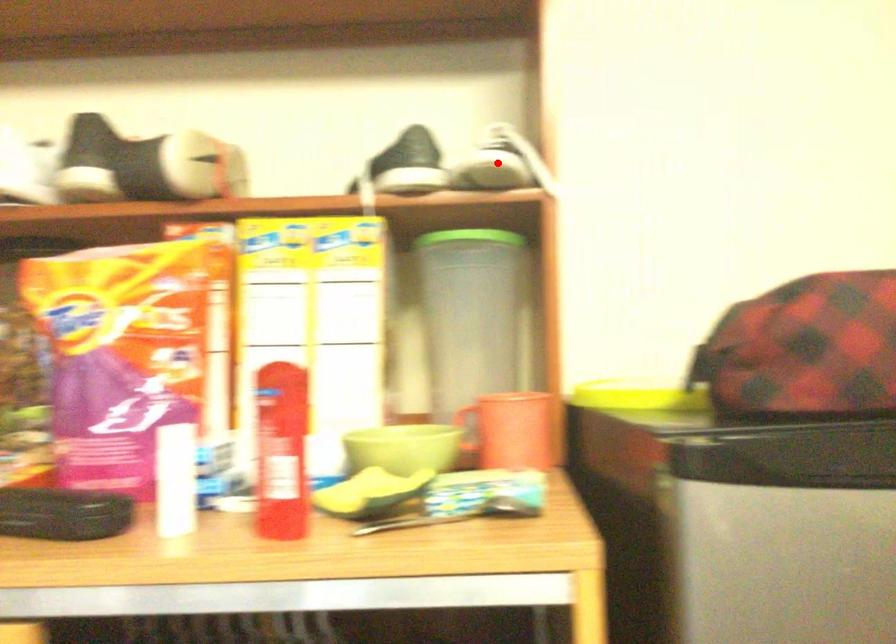
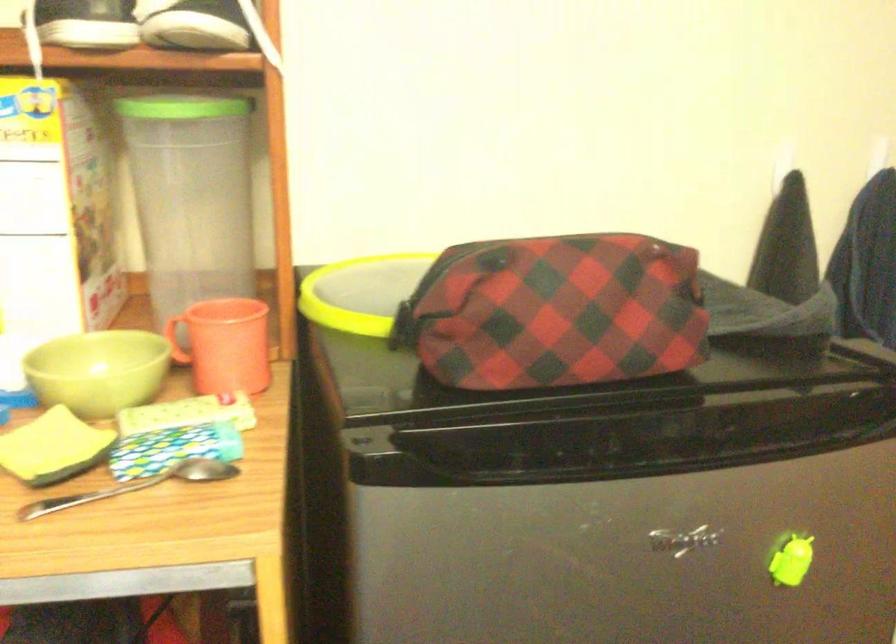
Find the pixel in the second image that matches the highlighted location in the first image.

(197, 26)